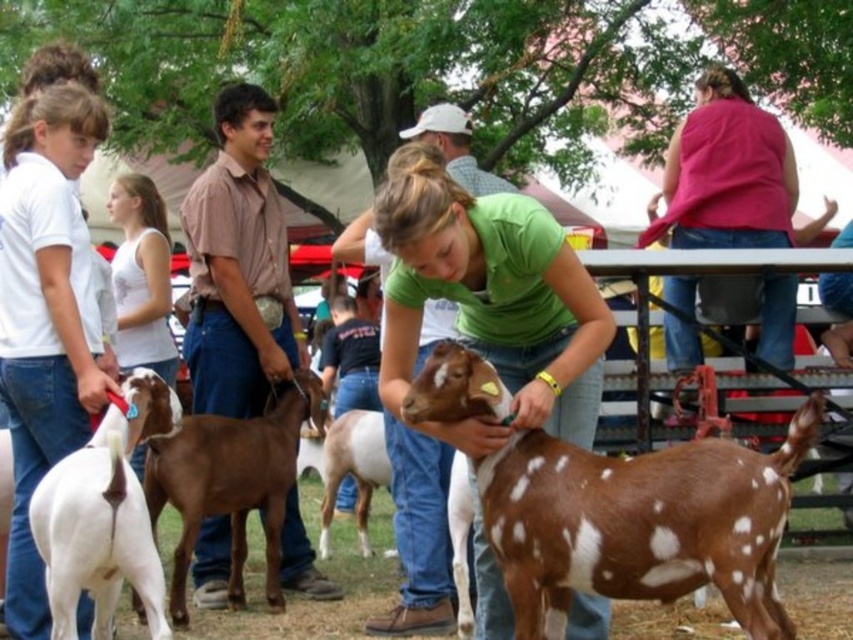
Question: Estimate the real-world distances between objects in this image. Which object is farther from the green matte shirt at center?

Choices:
 (A) white matte goat at left
 (B) brown spotted fur at center
 (C) brown speckled fur at center

Answer: (C)

Question: Is brown spotted fur at center smaller than brown speckled fur at center?

Choices:
 (A) no
 (B) yes

Answer: (B)

Question: Which point appears closest to the camera in this image?

Choices:
 (A) (372, 436)
 (B) (22, 349)
 (C) (741, 540)
 (D) (152, 362)

Answer: (C)

Question: Does green matte shirt at center have a lesser width compared to brown speckled fur at center?

Choices:
 (A) no
 (B) yes

Answer: (B)

Question: Which point is farther to the camera?

Choices:
 (A) (409, 291)
 (B) (70, 289)

Answer: (B)

Question: Is brown speckled fur at center in front of white speckled fur at center?

Choices:
 (A) yes
 (B) no

Answer: (A)